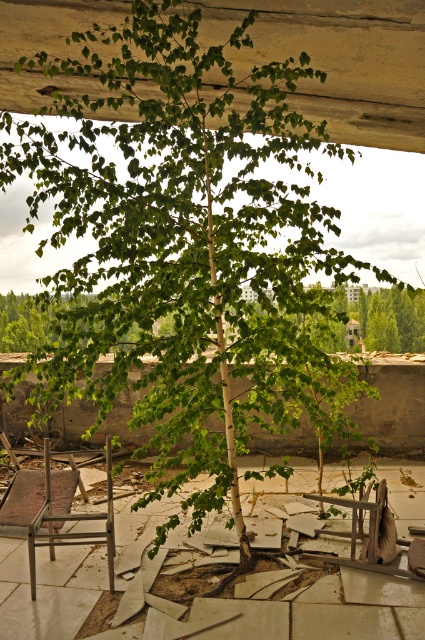
Who is positioned more to the right, green leafy tree at center or metallic silver chair at lower left?

metallic silver chair at lower left is more to the right.

Is green leafy tree at center thinner than metallic silver chair at lower left?

Correct, green leafy tree at center's width is less than metallic silver chair at lower left's.

Who is more forward, [31,342] or [110,544]?

Point [110,544] is more forward.

This screenshot has width=425, height=640. What are the coordinates of `green leafy tree at center` in the screenshot? It's located at (388, 317).